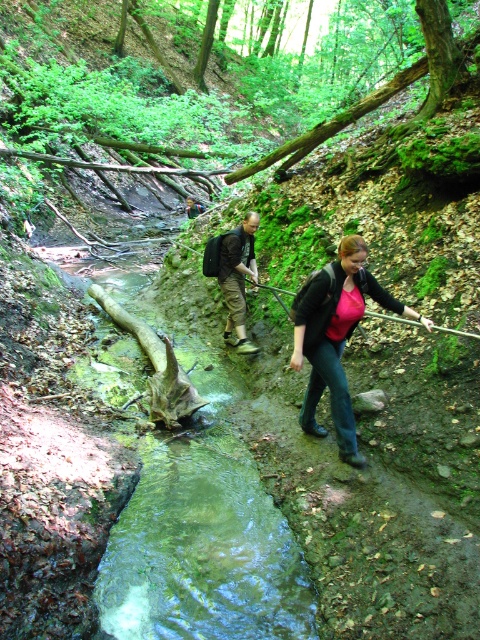
Question: Is matte black jacket at center wider than dark brown leather backpack at center?

Choices:
 (A) no
 (B) yes

Answer: (B)

Question: Is matte black jacket at center below dark brown leather backpack at center?

Choices:
 (A) no
 (B) yes

Answer: (B)

Question: Does matte black jacket at center come in front of dark brown leather backpack at center?

Choices:
 (A) yes
 (B) no

Answer: (A)

Question: Which point appears closest to the camera in this image?

Choices:
 (A) (233, 273)
 (B) (308, 394)

Answer: (B)